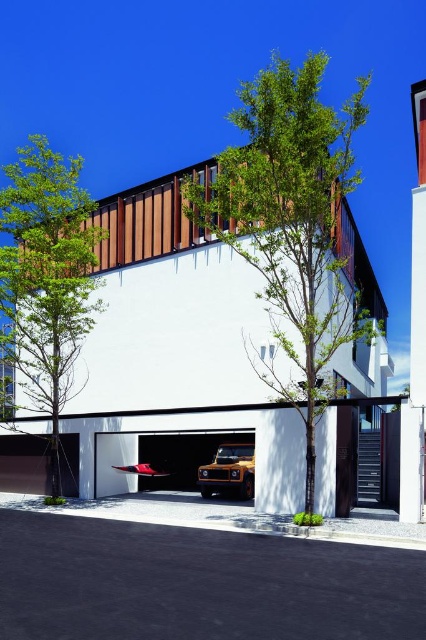
Question: Which of the following is the closest to the observer?

Choices:
 (A) green leafy tree at left
 (B) matte orange suv at center

Answer: (A)

Question: Which of the following is the farthest from the observer?

Choices:
 (A) green leafy tree at left
 (B) white glossy garage door at center
 (C) green leafy tree at center
 (D) white matte garage door at lower left

Answer: (D)

Question: Considering the real-world distances, which object is closest to the green leafy tree at center?

Choices:
 (A) matte orange suv at center
 (B) green leafy tree at left
 (C) white glossy garage door at center

Answer: (A)

Question: Is white glossy garage door at center closer to camera compared to white matte garage door at lower left?

Choices:
 (A) no
 (B) yes

Answer: (B)

Question: In this image, where is white glossy garage door at center located relative to matte orange suv at center?

Choices:
 (A) above
 (B) below

Answer: (B)

Question: Can you confirm if white glossy garage door at center is smaller than white matte garage door at lower left?

Choices:
 (A) yes
 (B) no

Answer: (B)